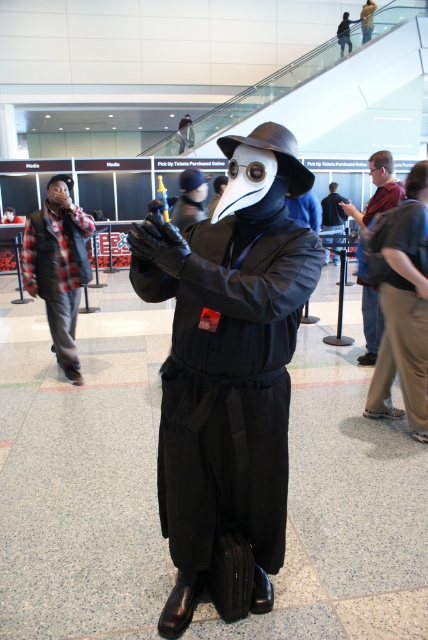
What is located at the coordinates point (228, 362) in the image?

The point (228, 362) corresponds to the matte black costume at center.

You are a costume designer who needs to ensure the proportions of the matte black costume at center and the matte black mask at center are correct for a theatrical performance. Based on the image, which object is taller?

The matte black costume at center is taller than the matte black mask at center according to the description.